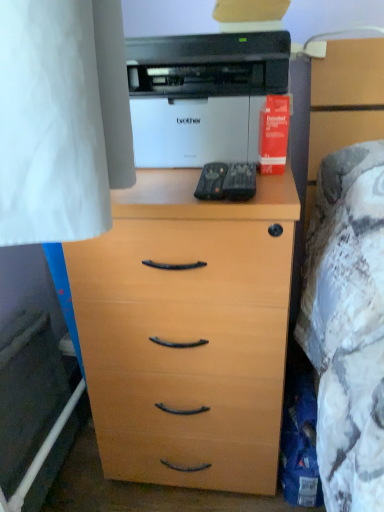
Question: Should I look upward or downward to see light wood chest of drawers at center?

Choices:
 (A) up
 (B) down

Answer: (B)

Question: Considering the relative positions of light wood chest of drawers at center and red matte paper at upper right in the image provided, is light wood chest of drawers at center behind red matte paper at upper right?

Choices:
 (A) no
 (B) yes

Answer: (A)

Question: Would you say light wood chest of drawers at center is outside red matte paper at upper right?

Choices:
 (A) yes
 (B) no

Answer: (A)

Question: Is light wood chest of drawers at center closer to the viewer compared to red matte paper at upper right?

Choices:
 (A) no
 (B) yes

Answer: (B)

Question: From the image's perspective, is light wood chest of drawers at center on top of red matte paper at upper right?

Choices:
 (A) yes
 (B) no

Answer: (B)

Question: Considering the relative positions of light wood chest of drawers at center and red matte paper at upper right in the image provided, is light wood chest of drawers at center to the left of red matte paper at upper right from the viewer's perspective?

Choices:
 (A) no
 (B) yes

Answer: (B)

Question: Is light wood chest of drawers at center taller than red matte paper at upper right?

Choices:
 (A) no
 (B) yes

Answer: (B)

Question: Is light wood chest of drawers at center at the back of red matte paper at upper right?

Choices:
 (A) yes
 (B) no

Answer: (B)

Question: Can you confirm if red matte paper at upper right is thinner than light wood chest of drawers at center?

Choices:
 (A) no
 (B) yes

Answer: (B)

Question: Can you confirm if red matte paper at upper right is smaller than light wood chest of drawers at center?

Choices:
 (A) yes
 (B) no

Answer: (A)

Question: Is red matte paper at upper right outside of light wood chest of drawers at center?

Choices:
 (A) yes
 (B) no

Answer: (A)

Question: Would you say light wood chest of drawers at center is part of red matte paper at upper right's contents?

Choices:
 (A) no
 (B) yes

Answer: (A)

Question: From the image's perspective, would you say red matte paper at upper right is shown under light wood chest of drawers at center?

Choices:
 (A) no
 (B) yes

Answer: (A)

Question: Considering the relative sizes of light wood chest of drawers at center and white glossy printer at upper center in the image provided, is light wood chest of drawers at center taller than white glossy printer at upper center?

Choices:
 (A) yes
 (B) no

Answer: (A)